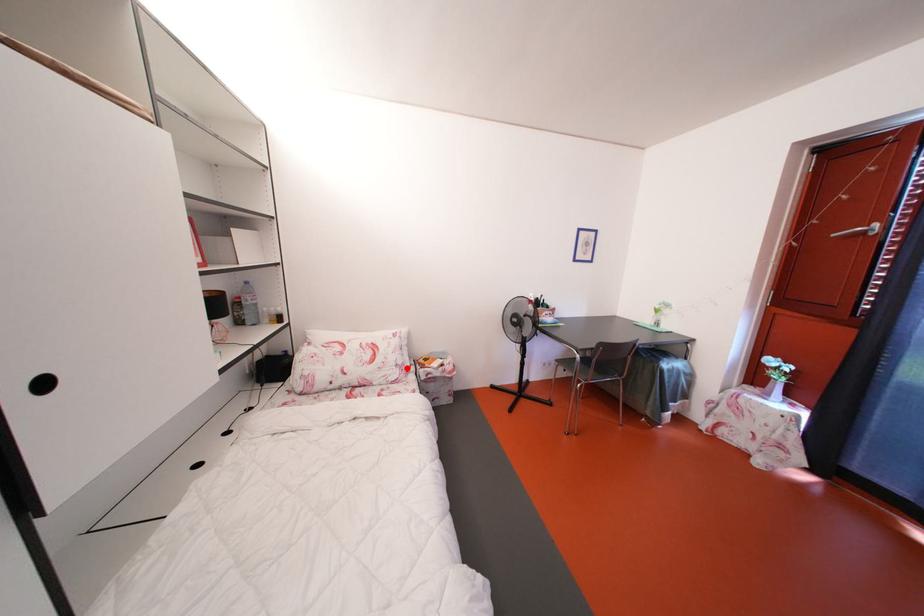
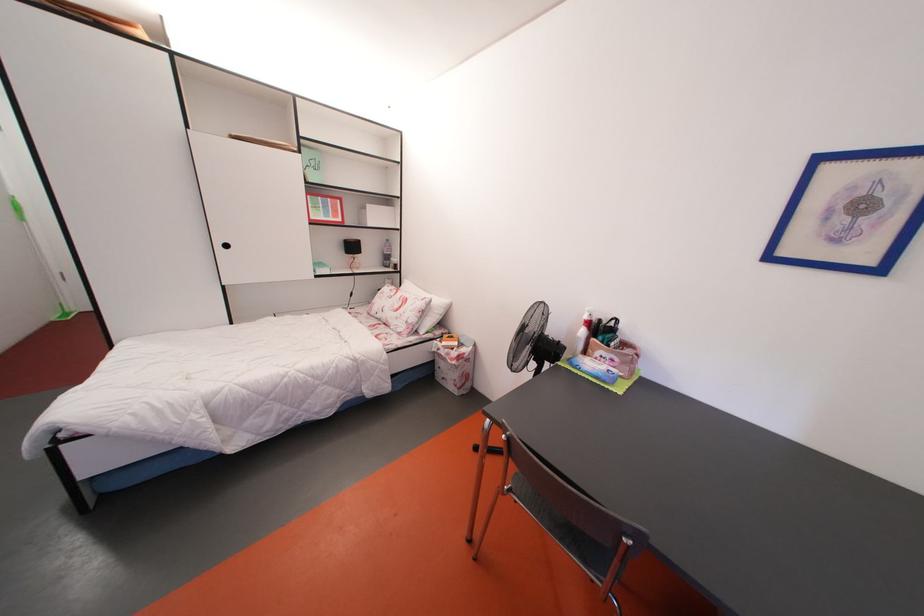
Question: I am providing you with two images of the same scene from different viewpoints. A red point is shown in image1. For the corresponding object point in image2, is it positioned nearer or farther from the camera?

Choices:
 (A) Nearer
 (B) Farther

Answer: (B)